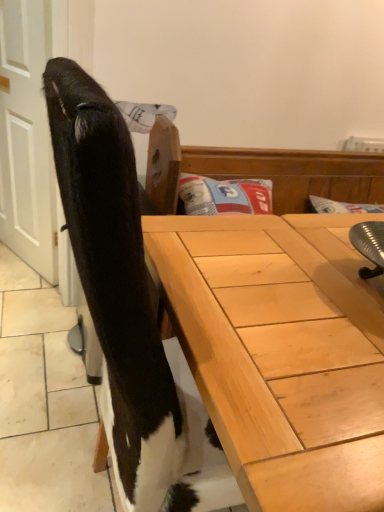
Question: Would you say black matte screen door at left is inside or outside light wood desk at lower right?

Choices:
 (A) outside
 (B) inside

Answer: (A)

Question: Visually, is black matte screen door at left positioned to the left or to the right of light wood desk at lower right?

Choices:
 (A) right
 (B) left

Answer: (B)

Question: Looking at the image, does black matte screen door at left seem bigger or smaller compared to light wood desk at lower right?

Choices:
 (A) small
 (B) big

Answer: (A)

Question: Is light wood desk at lower right wider or thinner than black matte screen door at left?

Choices:
 (A) thin
 (B) wide

Answer: (B)

Question: Is light wood desk at lower right inside or outside of black matte screen door at left?

Choices:
 (A) outside
 (B) inside

Answer: (A)

Question: Relative to black matte screen door at left, is light wood desk at lower right in front or behind?

Choices:
 (A) front
 (B) behind

Answer: (A)

Question: Is light wood desk at lower right taller or shorter than black matte screen door at left?

Choices:
 (A) tall
 (B) short

Answer: (B)